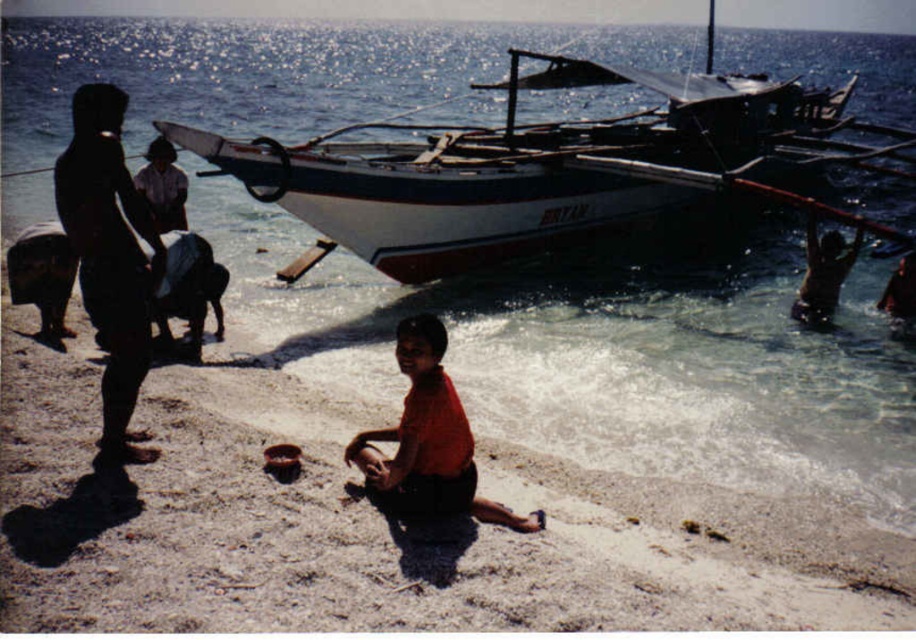
You are a photographer trying to capture a photo of the beach scene. You notice the dark matte clothing at left and the matte orange shirt at center. Which object is closer to the camera?

The dark matte clothing at left is closer to the camera because the matte orange shirt at center is behind it.

You are a photographer taking a picture of the beach scene. You notice the dark matte clothing at left and the white cotton shirt at center. Which clothing item appears lower in the photo?

The dark matte clothing at left appears lower in the photo because it is positioned below the white cotton shirt at center.